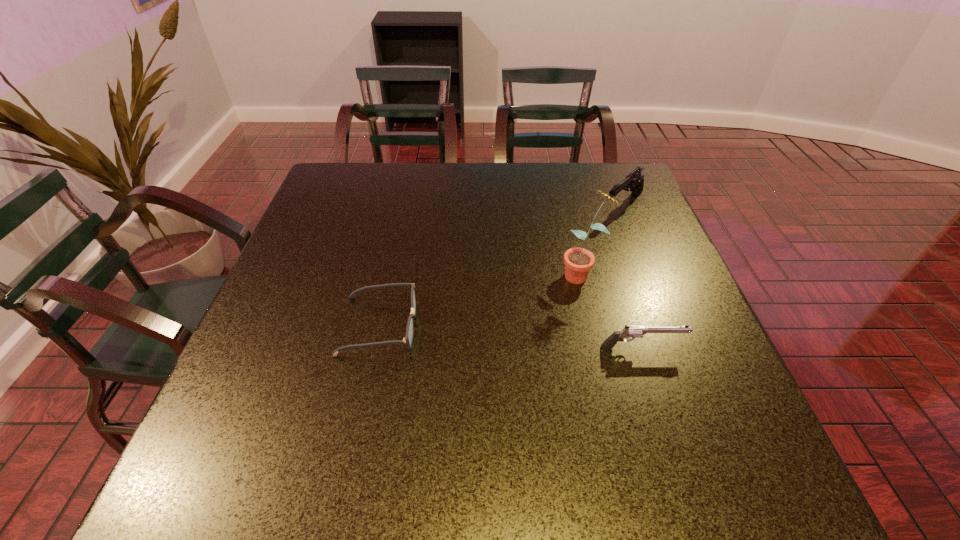
Image resolution: width=960 pixels, height=540 pixels. What are the coordinates of `vacant point that satisfies the following two spatial constraints: 1. on the front side of the tallest object; 2. on the front-facing side of the pistol` in the screenshot? It's located at coord(600,347).